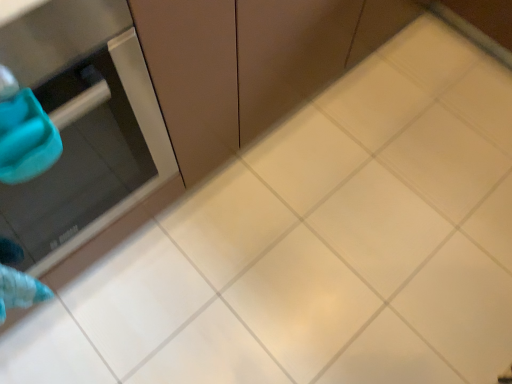
Question: From a real-world perspective, is matte brown cabinet at center on top of stainless steel oven at left?

Choices:
 (A) yes
 (B) no

Answer: (B)

Question: Is stainless steel oven at left at the back of matte brown cabinet at center?

Choices:
 (A) no
 (B) yes

Answer: (A)

Question: Is matte brown cabinet at center placed right next to stainless steel oven at left?

Choices:
 (A) no
 (B) yes

Answer: (A)

Question: Would you say stainless steel oven at left is part of matte brown cabinet at center's contents?

Choices:
 (A) no
 (B) yes

Answer: (A)

Question: Considering the relative sizes of matte brown cabinet at center and stainless steel oven at left in the image provided, is matte brown cabinet at center thinner than stainless steel oven at left?

Choices:
 (A) no
 (B) yes

Answer: (B)

Question: From a real-world perspective, is matte brown cabinet at center under stainless steel oven at left?

Choices:
 (A) no
 (B) yes

Answer: (B)

Question: Is stainless steel oven at left further to camera compared to matte brown cabinet at center?

Choices:
 (A) yes
 (B) no

Answer: (B)

Question: From a real-world perspective, is stainless steel oven at left below matte brown cabinet at center?

Choices:
 (A) yes
 (B) no

Answer: (B)

Question: Does stainless steel oven at left have a greater width compared to matte brown cabinet at center?

Choices:
 (A) yes
 (B) no

Answer: (A)

Question: Can you confirm if stainless steel oven at left is thinner than matte brown cabinet at center?

Choices:
 (A) no
 (B) yes

Answer: (A)

Question: Is stainless steel oven at left not close to matte brown cabinet at center?

Choices:
 (A) no
 (B) yes

Answer: (A)

Question: From the image's perspective, is stainless steel oven at left located beneath matte brown cabinet at center?

Choices:
 (A) yes
 (B) no

Answer: (A)

Question: From a real-world perspective, is stainless steel oven at left physically located above or below matte brown cabinet at center?

Choices:
 (A) above
 (B) below

Answer: (A)